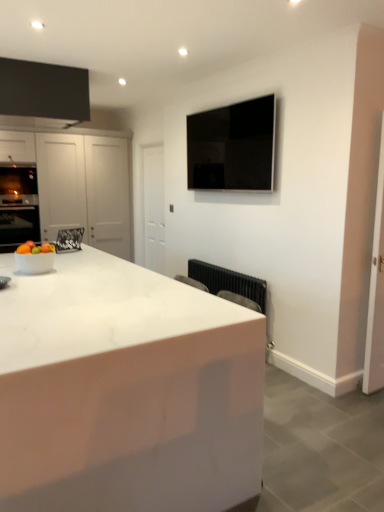
Question: Is black metallic radiator at lower center looking in the opposite direction of white marble countertop at center?

Choices:
 (A) no
 (B) yes

Answer: (A)

Question: Can you confirm if black metallic radiator at lower center is thinner than white marble countertop at center?

Choices:
 (A) no
 (B) yes

Answer: (B)

Question: Considering the relative positions of black metallic radiator at lower center and white marble countertop at center in the image provided, is black metallic radiator at lower center to the left of white marble countertop at center from the viewer's perspective?

Choices:
 (A) no
 (B) yes

Answer: (A)

Question: Is white marble countertop at center a part of black metallic radiator at lower center?

Choices:
 (A) no
 (B) yes

Answer: (A)

Question: Does black metallic radiator at lower center come in front of white marble countertop at center?

Choices:
 (A) yes
 (B) no

Answer: (B)

Question: Is black metallic radiator at lower center to the right of white marble countertop at center from the viewer's perspective?

Choices:
 (A) yes
 (B) no

Answer: (A)

Question: From the image's perspective, does white marble countertop at center appear higher than shiny white bowl at left?

Choices:
 (A) yes
 (B) no

Answer: (B)

Question: Does white marble countertop at center appear on the left side of shiny white bowl at left?

Choices:
 (A) no
 (B) yes

Answer: (A)

Question: Is white marble countertop at center smaller than shiny white bowl at left?

Choices:
 (A) no
 (B) yes

Answer: (A)

Question: Considering the relative sizes of white marble countertop at center and shiny white bowl at left in the image provided, is white marble countertop at center bigger than shiny white bowl at left?

Choices:
 (A) yes
 (B) no

Answer: (A)

Question: Is white marble countertop at center to the right of shiny white bowl at left from the viewer's perspective?

Choices:
 (A) no
 (B) yes

Answer: (B)

Question: Is the position of white marble countertop at center less distant than that of shiny white bowl at left?

Choices:
 (A) no
 (B) yes

Answer: (B)

Question: From a real-world perspective, is white marble countertop at center physically above black glossy tv at upper center?

Choices:
 (A) yes
 (B) no

Answer: (B)